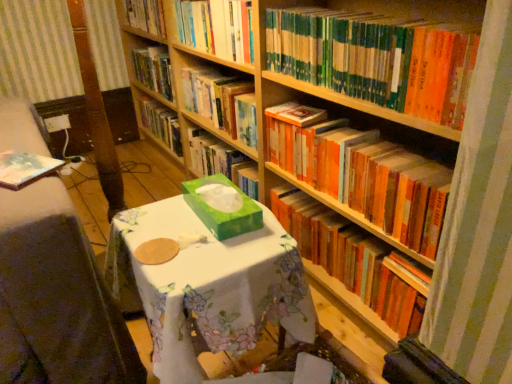
In the scene shown: What is the approximate width of orange matte bookshelf at upper right, marked as the 4th book in a top-to-bottom arrangement?

9.73 inches.

What is the approximate width of orange matte bookshelf at center, which is the 1th book from bottom to top?

orange matte bookshelf at center, which is the 1th book from bottom to top, is 7.14 inches in width.

Locate an element on the screen. orange matte bookshelf at center, which is the 1th book from bottom to top is located at coordinates (352, 258).

How much space does green matte bookshelf at upper right, which is the 3th book in top-to-bottom order, occupy horizontally?

green matte bookshelf at upper right, which is the 3th book in top-to-bottom order, is 9.73 inches in width.

This screenshot has width=512, height=384. What do you see at coordinates (223, 212) in the screenshot?
I see `green matte tissue box at center` at bounding box center [223, 212].

Find the location of a particular element. orange matte bookshelf at upper right, marked as the 4th book in a top-to-bottom arrangement is located at coordinates (362, 173).

Is green matte tissue box at center bigger or smaller than hardcover books at upper center, positioned as the 1th book in top-to-bottom order?

Considering their sizes, green matte tissue box at center takes up less space than hardcover books at upper center, positioned as the 1th book in top-to-bottom order.

Visually, is green matte tissue box at center positioned to the left or to the right of hardcover books at upper center, which appears as the fifth book when ordered from the bottom?

From the image, it's evident that green matte tissue box at center is to the right of hardcover books at upper center, which appears as the fifth book when ordered from the bottom.

Between green matte tissue box at center and hardcover books at upper center, which appears as the fifth book when ordered from the bottom, which one has smaller width?

With smaller width is hardcover books at upper center, which appears as the fifth book when ordered from the bottom.

From the image's perspective, which book is the 4th one above the green matte tissue box at center? Please provide its 2D coordinates.

[(216, 27)]

Considering the relative positions of hardcover book at center, which is the second book in top-to-bottom order, and orange matte bookshelf at center, the 5th book from the top, in the image provided, is hardcover book at center, which is the second book in top-to-bottom order, to the right of orange matte bookshelf at center, the 5th book from the top, from the viewer's perspective?

No.

From the image's perspective, is hardcover book at center, which is the second book in top-to-bottom order, above orange matte bookshelf at center, the 5th book from the top?

Correct, hardcover book at center, which is the second book in top-to-bottom order, appears higher than orange matte bookshelf at center, the 5th book from the top, in the image.

Would you say hardcover book at center, which is the second book in top-to-bottom order, contains orange matte bookshelf at center, which is the 1th book from bottom to top?

No.

Which book is the 1st one when counting from the right side of the hardcover book at center, which is the second book in top-to-bottom order? Please provide its 2D coordinates.

[(352, 258)]

Considering the relative positions of green matte tissue box at center and green floral tablecloth at center in the image provided, is green matte tissue box at center to the right of green floral tablecloth at center from the viewer's perspective?

Yes.

Considering their positions, is green matte tissue box at center located in front of or behind green floral tablecloth at center?

green matte tissue box at center is positioned farther from the viewer than green floral tablecloth at center.

Which of these two, green matte tissue box at center or green floral tablecloth at center, stands shorter?

green matte tissue box at center.

How much distance is there between green matte tissue box at center and green floral tablecloth at center?

green matte tissue box at center and green floral tablecloth at center are 14.05 centimeters apart.

Is point (287, 171) closer to viewer compared to point (240, 91)?

Yes, point (287, 171) is closer to viewer.

From the image's perspective, relative to hardcover book at center, acting as the fourth book starting from the bottom, is orange matte bookshelf at upper right, marked as the 4th book in a top-to-bottom arrangement, above or below?

From the image's perspective, orange matte bookshelf at upper right, marked as the 4th book in a top-to-bottom arrangement, appears below hardcover book at center, acting as the fourth book starting from the bottom.

Is orange matte bookshelf at upper right, positioned as the 2th book in bottom-to-top order, next to hardcover book at center, acting as the fourth book starting from the bottom, and touching it?

orange matte bookshelf at upper right, positioned as the 2th book in bottom-to-top order, and hardcover book at center, acting as the fourth book starting from the bottom, are not in contact.

What's the angular difference between orange matte bookshelf at upper right, positioned as the 2th book in bottom-to-top order, and hardcover book at center, which is the second book in top-to-bottom order,'s facing directions?

The angle between the facing direction of orange matte bookshelf at upper right, positioned as the 2th book in bottom-to-top order, and the facing direction of hardcover book at center, which is the second book in top-to-bottom order, is 0.000635 degrees.

Locate an element on the screen. The height and width of the screenshot is (384, 512). round table in front of the hardcover book at center, acting as the fourth book starting from the bottom is located at coordinates (207, 286).

From a real-world perspective, which object stands above the other?

hardcover book at center, which is the second book in top-to-bottom order, is physically above.

Consider the image. Is hardcover book at center, acting as the fourth book starting from the bottom, not near green floral tablecloth at center?

No.

Is hardcover book at center, acting as the fourth book starting from the bottom, turned away from green floral tablecloth at center?

No, hardcover book at center, acting as the fourth book starting from the bottom, is not facing away from green floral tablecloth at center.

Can you confirm if hardcover books at upper center, positioned as the 1th book in top-to-bottom order, is thinner than green matte tissue box at center?

Correct, the width of hardcover books at upper center, positioned as the 1th book in top-to-bottom order, is less than that of green matte tissue box at center.

Between hardcover books at upper center, which appears as the fifth book when ordered from the bottom, and green matte tissue box at center, which one has less height?

With less height is green matte tissue box at center.

Is hardcover books at upper center, positioned as the 1th book in top-to-bottom order, located outside green matte tissue box at center?

That's correct, hardcover books at upper center, positioned as the 1th book in top-to-bottom order, is outside of green matte tissue box at center.

What's the angular difference between orange matte bookshelf at center, the 5th book from the top, and green floral tablecloth at center's facing directions?

There is a 87.9-degree angle between the facing directions of orange matte bookshelf at center, the 5th book from the top, and green floral tablecloth at center.

Is green floral tablecloth at center surrounded by orange matte bookshelf at center, the 5th book from the top?

That's incorrect, green floral tablecloth at center is not inside orange matte bookshelf at center, the 5th book from the top.

Which is behind, point (370, 251) or point (177, 267)?

The point (370, 251) is farther from the camera.

Does orange matte bookshelf at center, the 5th book from the top, come in front of green floral tablecloth at center?

No, orange matte bookshelf at center, the 5th book from the top, is further to the viewer.

Identify the location of the 3rd book behind when counting from the green matte tissue box at center. (216, 27).

This screenshot has height=384, width=512. What are the coordinates of `the 2nd book located beneath the hardcover book at center, which is the second book in top-to-bottom order (from a real-world perspective)` in the screenshot? It's located at (352, 258).

Consider the image. When comparing their distances from orange matte bookshelf at center, the 5th book from the top, does green matte tissue box at center or green floral tablecloth at center seem further?

green floral tablecloth at center is further to orange matte bookshelf at center, the 5th book from the top.

From the image, which object appears to be nearer to hardcover book at center, acting as the fourth book starting from the bottom, green matte tissue box at center or green floral tablecloth at center?

Based on the image, green matte tissue box at center appears to be nearer to hardcover book at center, acting as the fourth book starting from the bottom.

Estimate the real-world distances between objects in this image. Which object is further from orange matte bookshelf at center, the 5th book from the top, green floral tablecloth at center or orange matte bookshelf at upper right, positioned as the 2th book in bottom-to-top order?

green floral tablecloth at center is positioned further to the anchor orange matte bookshelf at center, the 5th book from the top.

When comparing their distances from green matte bookshelf at upper right, which is the 3th book in top-to-bottom order, does hardcover book at center, which is the second book in top-to-bottom order, or orange matte bookshelf at upper right, marked as the 4th book in a top-to-bottom arrangement, seem closer?

The object closer to green matte bookshelf at upper right, which is the 3th book in top-to-bottom order, is orange matte bookshelf at upper right, marked as the 4th book in a top-to-bottom arrangement.

Estimate the real-world distances between objects in this image. Which object is further from green floral tablecloth at center, green matte tissue box at center or orange matte bookshelf at upper right, marked as the 4th book in a top-to-bottom arrangement?

The object further to green floral tablecloth at center is orange matte bookshelf at upper right, marked as the 4th book in a top-to-bottom arrangement.

Looking at the image, which one is located closer to green matte bookshelf at upper right, marked as the 3th book in a bottom-to-top arrangement, hardcover books at upper center, positioned as the 1th book in top-to-bottom order, or green floral tablecloth at center?

Based on the image, hardcover books at upper center, positioned as the 1th book in top-to-bottom order, appears to be nearer to green matte bookshelf at upper right, marked as the 3th book in a bottom-to-top arrangement.

Considering their positions, is orange matte bookshelf at upper right, positioned as the 2th book in bottom-to-top order, positioned closer to orange matte bookshelf at center, which is the 1th book from bottom to top, than hardcover book at center, which is the second book in top-to-bottom order?

orange matte bookshelf at upper right, positioned as the 2th book in bottom-to-top order, is positioned closer to the anchor orange matte bookshelf at center, which is the 1th book from bottom to top.

Considering their positions, is orange matte bookshelf at upper right, marked as the 4th book in a top-to-bottom arrangement, positioned closer to green matte bookshelf at upper right, marked as the 3th book in a bottom-to-top arrangement, than hardcover book at center, acting as the fourth book starting from the bottom?

orange matte bookshelf at upper right, marked as the 4th book in a top-to-bottom arrangement, is positioned closer to the anchor green matte bookshelf at upper right, marked as the 3th book in a bottom-to-top arrangement.

Identify the location of cardboard box that lies between hardcover books at upper center, which appears as the fifth book when ordered from the bottom, and green floral tablecloth at center from top to bottom. This screenshot has width=512, height=384. (223, 212).

This screenshot has height=384, width=512. I want to click on cardboard box between green floral tablecloth at center and orange matte bookshelf at upper right, positioned as the 2th book in bottom-to-top order, so click(223, 212).

You are a GUI agent. You are given a task and a screenshot of the screen. Output one action in this format:
    pyautogui.click(x=<x>, y=<y>)
    Task: Click on the cardboard box between green floral tablecloth at center and hardcover book at center, which is the second book in top-to-bottom order, in the front-back direction
    This screenshot has height=384, width=512.
    Given the screenshot: What is the action you would take?
    pyautogui.click(x=223, y=212)

This screenshot has height=384, width=512. In order to click on cardboard box between green floral tablecloth at center and orange matte bookshelf at center, which is the 1th book from bottom to top, from left to right in this screenshot , I will do `click(223, 212)`.